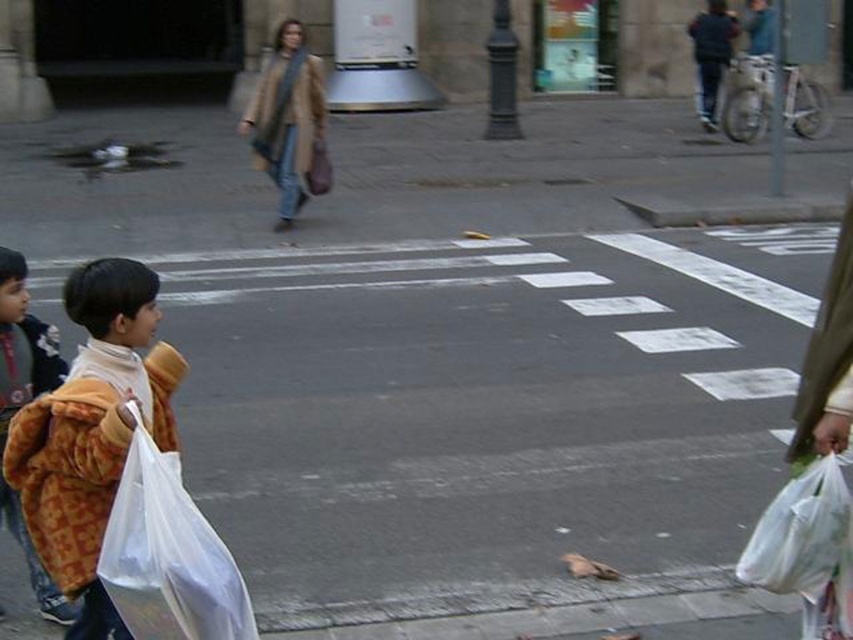
Question: Which object is closer to the camera taking this photo?

Choices:
 (A) beige wool coat at center
 (B) fluffy brown coat at lower left
 (C) yellow fur coat at left

Answer: (B)

Question: Which object appears farthest from the camera in this image?

Choices:
 (A) fluffy brown coat at lower left
 (B) beige wool coat at center
 (C) yellow fur coat at left
 (D) white plastic bag at lower left

Answer: (B)

Question: Is beige wool coat at center to the left of yellow fur coat at left from the viewer's perspective?

Choices:
 (A) yes
 (B) no

Answer: (B)

Question: Is the position of fluffy brown coat at lower left more distant than that of beige wool coat at center?

Choices:
 (A) yes
 (B) no

Answer: (B)

Question: Can you confirm if white plastic bag at lower left is wider than yellow fur coat at left?

Choices:
 (A) yes
 (B) no

Answer: (B)

Question: Among these objects, which one is nearest to the camera?

Choices:
 (A) white plastic bag at lower left
 (B) beige wool coat at center
 (C) yellow fur coat at left
 (D) fluffy brown coat at lower left

Answer: (A)